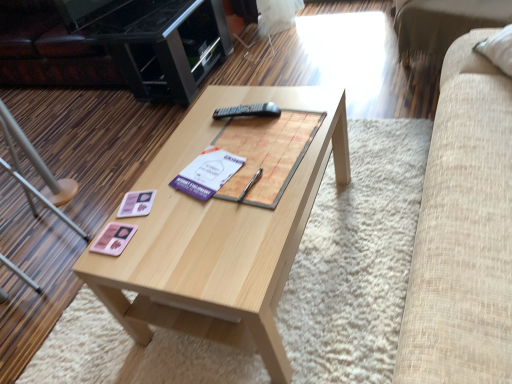
Where is `vacant region below metallic silver chair at lower left (from a real-world perspective)`? The height and width of the screenshot is (384, 512). vacant region below metallic silver chair at lower left (from a real-world perspective) is located at coordinates (56, 258).